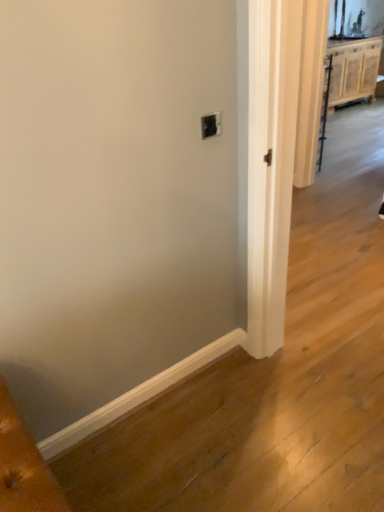
What is the approximate height of wooden cabinet at right?

wooden cabinet at right is 86.32 centimeters tall.

This screenshot has height=512, width=384. What do you see at coordinates (353, 70) in the screenshot? I see `wooden cabinet at right` at bounding box center [353, 70].

The height and width of the screenshot is (512, 384). I want to click on wooden cabinet at right, so coord(353,70).

This screenshot has height=512, width=384. Find the location of `wooden cabinet at right`. wooden cabinet at right is located at coordinates (353, 70).